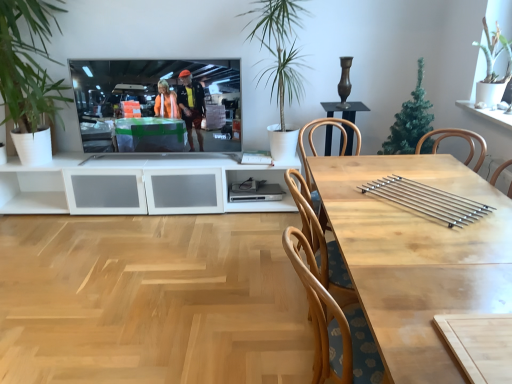
Question: Is green leafy plant at upper right, the first houseplant in the right-to-left sequence, to the right of green artificial tree at upper right, acting as the 2th houseplant starting from the right, from the viewer's perspective?

Choices:
 (A) yes
 (B) no

Answer: (A)

Question: Does green leafy plant at upper right, the fourth houseplant positioned from the left, have a greater width compared to green artificial tree at upper right, acting as the 2th houseplant starting from the right?

Choices:
 (A) yes
 (B) no

Answer: (B)

Question: Is the position of green leafy plant at upper right, the first houseplant in the right-to-left sequence, less distant than that of green artificial tree at upper right, acting as the 2th houseplant starting from the right?

Choices:
 (A) yes
 (B) no

Answer: (A)

Question: Considering the relative sizes of green leafy plant at upper right, the first houseplant in the right-to-left sequence, and green artificial tree at upper right, acting as the 2th houseplant starting from the right, in the image provided, is green leafy plant at upper right, the first houseplant in the right-to-left sequence, smaller than green artificial tree at upper right, acting as the 2th houseplant starting from the right,?

Choices:
 (A) no
 (B) yes

Answer: (B)

Question: Considering the relative positions of green leafy plant at upper right, the fourth houseplant positioned from the left, and green artificial tree at upper right, acting as the 2th houseplant starting from the right, in the image provided, is green leafy plant at upper right, the fourth houseplant positioned from the left, to the left of green artificial tree at upper right, acting as the 2th houseplant starting from the right, from the viewer's perspective?

Choices:
 (A) yes
 (B) no

Answer: (B)

Question: From their relative heights in the image, would you say green leafy plant at left, which is counted as the 4th houseplant, starting from the right, is taller or shorter than silver metallic bars at center?

Choices:
 (A) tall
 (B) short

Answer: (A)

Question: Is point (56, 97) closer or farther from the camera than point (498, 231)?

Choices:
 (A) closer
 (B) farther

Answer: (B)

Question: Looking at their shapes, would you say green leafy plant at left, the 1th houseplant from the left, is wider or thinner than silver metallic bars at center?

Choices:
 (A) wide
 (B) thin

Answer: (A)

Question: Is green leafy plant at left, which is counted as the 4th houseplant, starting from the right, bigger or smaller than silver metallic bars at center?

Choices:
 (A) big
 (B) small

Answer: (A)

Question: From a real-world perspective, relative to green artificial tree at upper right, acting as the 2th houseplant starting from the right, is light wood table at center vertically above or below?

Choices:
 (A) below
 (B) above

Answer: (A)

Question: From the image's perspective, is light wood table at center above or below green artificial tree at upper right, acting as the 2th houseplant starting from the right?

Choices:
 (A) below
 (B) above

Answer: (A)

Question: Looking at their shapes, would you say light wood table at center is wider or thinner than green artificial tree at upper right, acting as the third houseplant starting from the left?

Choices:
 (A) thin
 (B) wide

Answer: (B)

Question: Is light wood table at center inside the boundaries of green artificial tree at upper right, acting as the third houseplant starting from the left, or outside?

Choices:
 (A) outside
 (B) inside

Answer: (A)

Question: In terms of height, does silver metallic bars at center look taller or shorter compared to silver metallic television at center?

Choices:
 (A) tall
 (B) short

Answer: (B)

Question: Is silver metallic bars at center bigger or smaller than silver metallic television at center?

Choices:
 (A) big
 (B) small

Answer: (B)